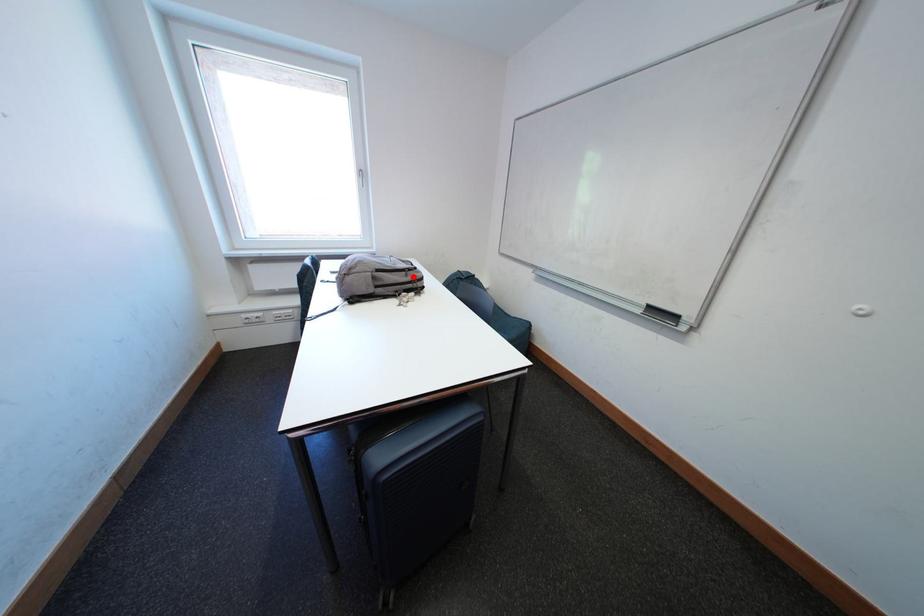
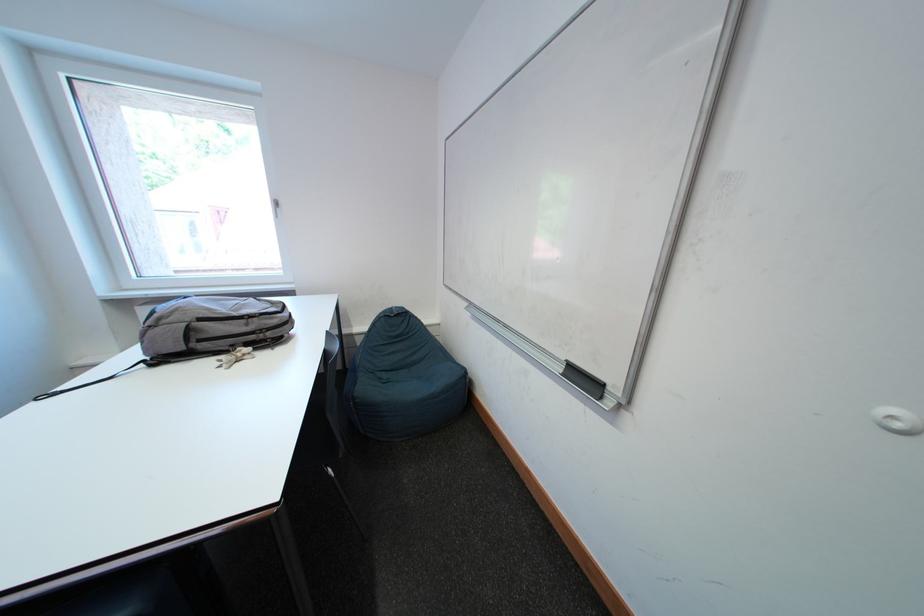
Locate, in the second image, the point that corresponds to the highlighted location in the first image.

(252, 325)